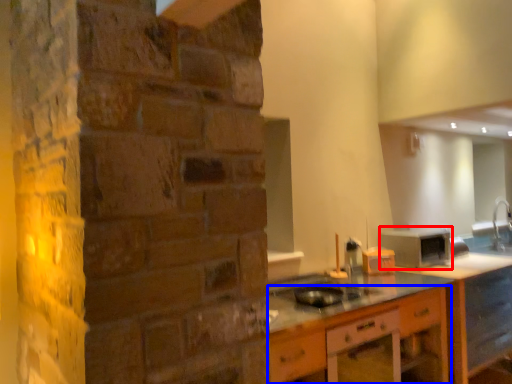
Question: Which of the following is the farthest to the observer, appliance (highlighted by a red box) or cabinetry (highlighted by a blue box)?

Choices:
 (A) appliance
 (B) cabinetry

Answer: (A)